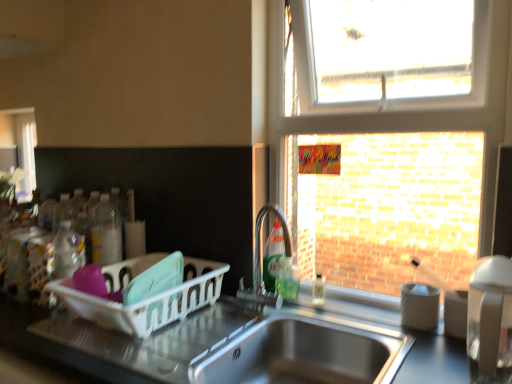
Describe the element at coordinates (385, 153) in the screenshot. The image size is (512, 384). I see `clear glass window at upper right` at that location.

Locate an element on the screen. clear glass window at upper right is located at coordinates (385, 153).

Find the location of `green translucent soap dispenser at sink, acting as the third bottle starting from the left`. green translucent soap dispenser at sink, acting as the third bottle starting from the left is located at coordinates [x=287, y=279].

The image size is (512, 384). Describe the element at coordinates (147, 300) in the screenshot. I see `white plastic dish rack at left, the 2th appliance in the front-to-back sequence` at that location.

The image size is (512, 384). Describe the element at coordinates (117, 342) in the screenshot. I see `metallic stainless steel sink at center` at that location.

The height and width of the screenshot is (384, 512). What are the coordinates of `clear plastic bottle at left, which is the 1th bottle from left to right` in the screenshot? It's located at (106, 232).

Does translucent plastic soap dispenser at sink right, which is counted as the 4th bottle, starting from the left, touch metallic stainless steel sink at center?

translucent plastic soap dispenser at sink right, which is counted as the 4th bottle, starting from the left, and metallic stainless steel sink at center are not in contact.

Consider the image. Is translucent plastic soap dispenser at sink right, which is counted as the 4th bottle, starting from the left, oriented towards metallic stainless steel sink at center?

Yes.

From the image's perspective, is translucent plastic soap dispenser at sink right, which is counted as the 4th bottle, starting from the left, located beneath metallic stainless steel sink at center?

Actually, translucent plastic soap dispenser at sink right, which is counted as the 4th bottle, starting from the left, appears above metallic stainless steel sink at center in the image.

Is translucent plastic soap dispenser at sink right, which is counted as the 4th bottle, starting from the left, inside the boundaries of metallic stainless steel sink at center, or outside?

translucent plastic soap dispenser at sink right, which is counted as the 4th bottle, starting from the left, is outside metallic stainless steel sink at center.

Would you say clear glass window at upper right is to the left or to the right of clear plastic bottle at left, which ranks as the 4th bottle in right-to-left order, in the picture?

Based on their positions, clear glass window at upper right is located to the right of clear plastic bottle at left, which ranks as the 4th bottle in right-to-left order.

Are clear glass window at upper right and clear plastic bottle at left, which is the 1th bottle from left to right, making contact?

No, clear glass window at upper right is not making contact with clear plastic bottle at left, which is the 1th bottle from left to right.

Which point is more forward, (493, 223) or (94, 230)?

The point (493, 223) is closer.

Which of these two, clear glass window at upper right or clear plastic bottle at left, which is the 1th bottle from left to right, is bigger?

clear glass window at upper right.

Which object is closer to the camera, green matte dish soap at center, the 2th bottle from the left, or metallic stainless steel sink at center?

metallic stainless steel sink at center is closer to the camera.

Considering the relative sizes of green matte dish soap at center, the 2th bottle from the left, and metallic stainless steel sink at center in the image provided, is green matte dish soap at center, the 2th bottle from the left, smaller than metallic stainless steel sink at center?

Yes, green matte dish soap at center, the 2th bottle from the left, is smaller than metallic stainless steel sink at center.

Considering the relative sizes of green matte dish soap at center, the 2th bottle from the left, and metallic stainless steel sink at center in the image provided, is green matte dish soap at center, the 2th bottle from the left, taller than metallic stainless steel sink at center?

No.

Identify the location of the 3rd bottle located above the metallic stainless steel sink at center (from a real-world perspective). This screenshot has width=512, height=384. (273, 256).

In the scene shown: Can you tell me how much metallic stainless steel sink at center and white glossy coffee maker at right, acting as the 2th appliance starting from the left, differ in facing direction?

metallic stainless steel sink at center and white glossy coffee maker at right, acting as the 2th appliance starting from the left, are facing 0.000502 degrees away from each other.

In the scene shown: Is the position of metallic stainless steel sink at center more distant than that of white glossy coffee maker at right, marked as the first appliance in a front-to-back arrangement?

No, the depth of metallic stainless steel sink at center is less than that of white glossy coffee maker at right, marked as the first appliance in a front-to-back arrangement.

Looking at this image, based on their sizes in the image, would you say metallic stainless steel sink at center is bigger or smaller than white glossy coffee maker at right, positioned as the 2th appliance in back-to-front order?

Clearly, metallic stainless steel sink at center is larger in size than white glossy coffee maker at right, positioned as the 2th appliance in back-to-front order.

From a real-world perspective, between metallic stainless steel sink at center and white glossy coffee maker at right, positioned as the 2th appliance in back-to-front order, who is vertically lower?

In real-world perspective, metallic stainless steel sink at center is lower.

Does point (115, 271) come farther from viewer compared to point (113, 212)?

No, (115, 271) is closer to viewer.

There is a clear plastic bottle at left, which ranks as the 4th bottle in right-to-left order. Identify the location of the 2nd appliance below it (from the image's perspective). (147, 300).

From a real-world perspective, is white plastic dish rack at left, acting as the 1th appliance starting from the back, on top of clear plastic bottle at left, which ranks as the 4th bottle in right-to-left order?

No, from a real-world perspective, white plastic dish rack at left, acting as the 1th appliance starting from the back, is not on top of clear plastic bottle at left, which ranks as the 4th bottle in right-to-left order.

Between white plastic dish rack at left, acting as the 1th appliance starting from the back, and clear plastic bottle at left, which is the 1th bottle from left to right, which one is positioned in front?

Positioned in front is white plastic dish rack at left, acting as the 1th appliance starting from the back.

Is clear plastic bottle at left, which ranks as the 4th bottle in right-to-left order, not within clear glass window at upper right?

clear plastic bottle at left, which ranks as the 4th bottle in right-to-left order, lies outside clear glass window at upper right's area.

Which is behind, point (116, 258) or point (416, 177)?

Point (116, 258)

Is clear plastic bottle at left, which is the 1th bottle from left to right, bigger than clear glass window at upper right?

Actually, clear plastic bottle at left, which is the 1th bottle from left to right, might be smaller than clear glass window at upper right.

The image size is (512, 384). Identify the location of window in front of the clear plastic bottle at left, which is the 1th bottle from left to right. (385, 153).

Is white glossy coffee maker at right, marked as the first appliance in a front-to-back arrangement, taller or shorter than green matte dish soap at center, which is the third bottle from right to left?

white glossy coffee maker at right, marked as the first appliance in a front-to-back arrangement, is taller than green matte dish soap at center, which is the third bottle from right to left.

Is white glossy coffee maker at right, acting as the 2th appliance starting from the left, not inside green matte dish soap at center, which is the third bottle from right to left?

Absolutely, white glossy coffee maker at right, acting as the 2th appliance starting from the left, is external to green matte dish soap at center, which is the third bottle from right to left.

In order to click on appliance above the green matte dish soap at center, which is the third bottle from right to left (from a real-world perspective) in this screenshot , I will do `click(490, 314)`.

You are a GUI agent. You are given a task and a screenshot of the screen. Output one action in this format:
    pyautogui.click(x=<x>, y=<y>)
    Task: Click on the bottle that is the 2nd object above the metallic stainless steel sink at center (from a real-world perspective)
    The width and height of the screenshot is (512, 384).
    Given the screenshot: What is the action you would take?
    pyautogui.click(x=318, y=291)

There is a clear glass window at upper right. Where is `the 1st bottle below it (from a real-world perspective)`? The height and width of the screenshot is (384, 512). the 1st bottle below it (from a real-world perspective) is located at coordinates (106, 232).

When comparing their distances from white glossy coffee maker at right, acting as the 2th appliance starting from the left, does clear glass window at upper right or white plastic dish rack at left, acting as the 1th appliance starting from the back, seem further?

white plastic dish rack at left, acting as the 1th appliance starting from the back, lies further to white glossy coffee maker at right, acting as the 2th appliance starting from the left, than the other object.

When comparing their distances from metallic stainless steel sink at center, does green translucent soap dispenser at sink, positioned as the 2th bottle in right-to-left order, or stainless steel sink at lower center seem closer?

The object closer to metallic stainless steel sink at center is stainless steel sink at lower center.

Considering their positions, is green translucent soap dispenser at sink, acting as the third bottle starting from the left, positioned closer to clear plastic bottle at left, which ranks as the 4th bottle in right-to-left order, than white plastic dish rack at left, the 2th appliance in the front-to-back sequence?

white plastic dish rack at left, the 2th appliance in the front-to-back sequence.

Considering their positions, is clear plastic bottle at left, which is the 1th bottle from left to right, positioned further to white glossy coffee maker at right, the 1th appliance in the right-to-left sequence, than metallic stainless steel sink at center?

clear plastic bottle at left, which is the 1th bottle from left to right, is further to white glossy coffee maker at right, the 1th appliance in the right-to-left sequence.

Estimate the real-world distances between objects in this image. Which object is closer to clear plastic bottle at left, which ranks as the 4th bottle in right-to-left order, clear glass window at upper right or translucent plastic soap dispenser at sink right, which is counted as the 4th bottle, starting from the left?

translucent plastic soap dispenser at sink right, which is counted as the 4th bottle, starting from the left, is closer to clear plastic bottle at left, which ranks as the 4th bottle in right-to-left order.

Based on their spatial positions, is clear glass window at upper right or white plastic dish rack at left, the 2th appliance from the right, closer to clear plastic bottle at left, which is the 1th bottle from left to right?

white plastic dish rack at left, the 2th appliance from the right, lies closer to clear plastic bottle at left, which is the 1th bottle from left to right, than the other object.

Estimate the real-world distances between objects in this image. Which object is closer to white glossy coffee maker at right, acting as the 2th appliance starting from the left, green translucent soap dispenser at sink, positioned as the 2th bottle in right-to-left order, or translucent plastic soap dispenser at sink right, which is counted as the 4th bottle, starting from the left?

translucent plastic soap dispenser at sink right, which is counted as the 4th bottle, starting from the left, is positioned closer to the anchor white glossy coffee maker at right, acting as the 2th appliance starting from the left.

Which object lies nearer to the anchor point white plastic dish rack at left, the 2th appliance in the front-to-back sequence, green translucent soap dispenser at sink, acting as the third bottle starting from the left, or clear glass window at upper right?

Among the two, green translucent soap dispenser at sink, acting as the third bottle starting from the left, is located nearer to white plastic dish rack at left, the 2th appliance in the front-to-back sequence.

Locate an element on the screen. window between clear plastic bottle at left, which ranks as the 4th bottle in right-to-left order, and white glossy coffee maker at right, the 1th appliance in the right-to-left sequence, in the horizontal direction is located at coordinates (385, 153).

At what (x,y) coordinates should I click in order to perform the action: click on bottle between clear plastic bottle at left, which ranks as the 4th bottle in right-to-left order, and green translucent soap dispenser at sink, acting as the third bottle starting from the left, from left to right. Please return your answer as a coordinate pair (x, y). Looking at the image, I should click on (273, 256).

You are a GUI agent. You are given a task and a screenshot of the screen. Output one action in this format:
    pyautogui.click(x=<x>, y=<y>)
    Task: Click on the counter top located between clear plastic bottle at left, which is the 1th bottle from left to right, and clear glass window at upper right in the left-right direction
    The image size is (512, 384).
    Given the screenshot: What is the action you would take?
    (117, 342)

The width and height of the screenshot is (512, 384). Identify the location of sink between clear glass window at upper right and metallic stainless steel sink at center from top to bottom. (303, 353).